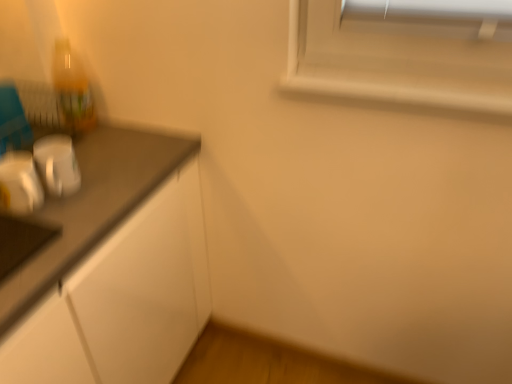
Question: Would you say metallic silver toaster at left is part of translucent plastic bottle at upper left's contents?

Choices:
 (A) yes
 (B) no

Answer: (B)

Question: Is translucent plastic bottle at upper left oriented away from metallic silver toaster at left?

Choices:
 (A) yes
 (B) no

Answer: (B)

Question: Is translucent plastic bottle at upper left at the right side of metallic silver toaster at left?

Choices:
 (A) yes
 (B) no

Answer: (B)

Question: From the image's perspective, is translucent plastic bottle at upper left above metallic silver toaster at left?

Choices:
 (A) yes
 (B) no

Answer: (A)

Question: Is translucent plastic bottle at upper left taller than metallic silver toaster at left?

Choices:
 (A) yes
 (B) no

Answer: (A)

Question: Are translucent plastic bottle at upper left and metallic silver toaster at left far apart?

Choices:
 (A) yes
 (B) no

Answer: (B)

Question: Is metallic silver toaster at left smaller than translucent plastic bottle at upper left?

Choices:
 (A) yes
 (B) no

Answer: (A)

Question: Considering the relative sizes of metallic silver toaster at left and translucent plastic bottle at upper left in the image provided, is metallic silver toaster at left thinner than translucent plastic bottle at upper left?

Choices:
 (A) yes
 (B) no

Answer: (B)

Question: Is metallic silver toaster at left looking in the opposite direction of translucent plastic bottle at upper left?

Choices:
 (A) yes
 (B) no

Answer: (B)

Question: From the image's perspective, is metallic silver toaster at left over translucent plastic bottle at upper left?

Choices:
 (A) yes
 (B) no

Answer: (B)

Question: Is the depth of metallic silver toaster at left less than that of translucent plastic bottle at upper left?

Choices:
 (A) no
 (B) yes

Answer: (B)

Question: Would you say translucent plastic bottle at upper left is part of metallic silver toaster at left's contents?

Choices:
 (A) yes
 (B) no

Answer: (B)

Question: From the image's perspective, is translucent plastic bottle at upper left above or below metallic silver toaster at left?

Choices:
 (A) above
 (B) below

Answer: (A)